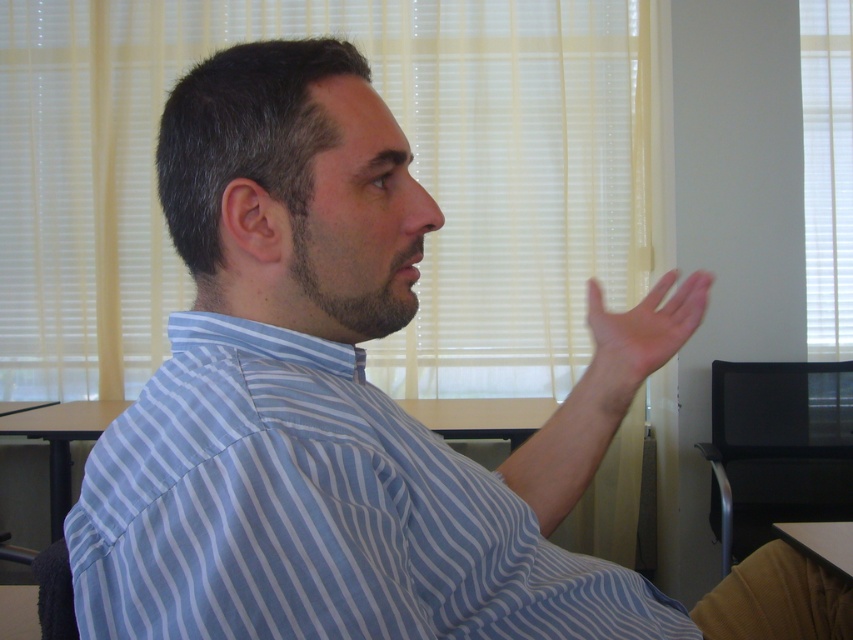
Question: Can you confirm if skinny flesh at right is positioned to the left of brown wooden desk at lower left?

Choices:
 (A) yes
 (B) no

Answer: (B)

Question: Among these points, which one is nearest to the camera?

Choices:
 (A) (688, 300)
 (B) (99, 422)
 (C) (392, 592)
 (D) (805, 529)

Answer: (C)

Question: Is skinny flesh at right below black plastic table at lower right?

Choices:
 (A) yes
 (B) no

Answer: (B)

Question: Among these objects, which one is farthest from the camera?

Choices:
 (A) brown wooden desk at lower left
 (B) skinny flesh at right
 (C) black plastic table at lower right

Answer: (A)

Question: Does skinny flesh at right have a lesser width compared to black plastic table at lower right?

Choices:
 (A) no
 (B) yes

Answer: (B)

Question: Which point is closer to the camera?

Choices:
 (A) (39, 408)
 (B) (343, 490)
 (C) (837, 538)
 (D) (643, 365)

Answer: (B)